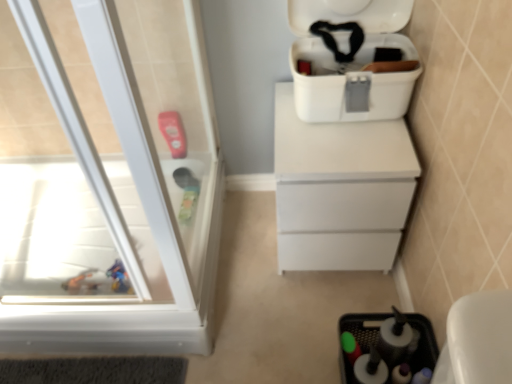
What are the coordinates of `free space to the right of transparent plastic screen door at left` in the screenshot? It's located at (270, 264).